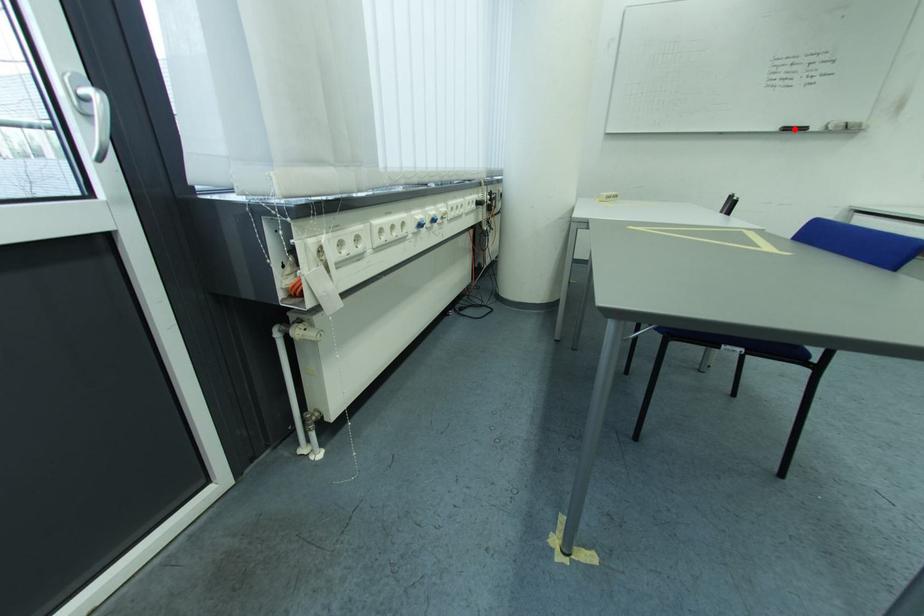
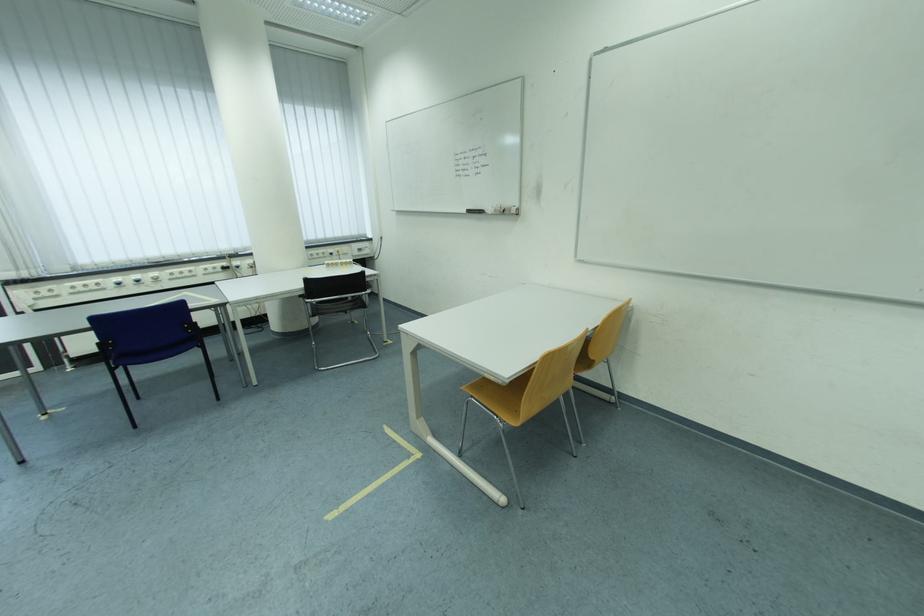
Locate, in the second image, the point that corresponds to the highlighted location in the first image.

(476, 213)